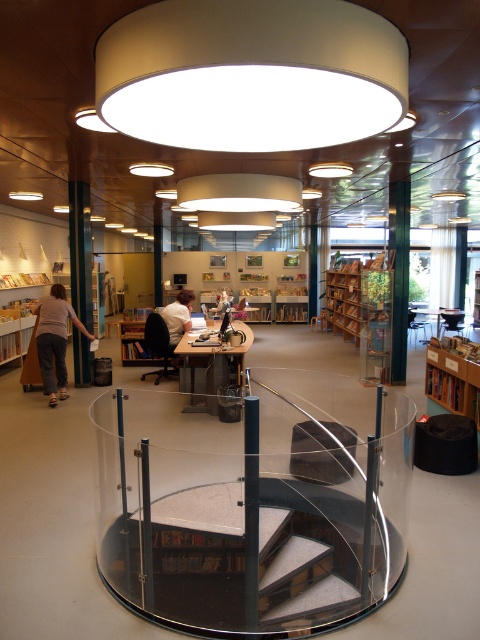
Question: Can you confirm if wooden bookshelf at center is positioned below white shirt at center?

Choices:
 (A) yes
 (B) no

Answer: (B)

Question: Can you confirm if matte gray pants at lower left is thinner than white shirt at center?

Choices:
 (A) yes
 (B) no

Answer: (B)

Question: Does transparent glass spiral staircase at center have a greater width compared to wooden bookshelf at lower right?

Choices:
 (A) yes
 (B) no

Answer: (A)

Question: Which point is closer to the camera?

Choices:
 (A) wooden bookshelf at lower right
 (B) matte black table at center

Answer: (A)

Question: Which point is closer to the camera taking this photo?

Choices:
 (A) (346, 321)
 (B) (44, 384)
 (C) (339, 429)

Answer: (C)

Question: Considering the real-world distances, which object is closest to the wooden bookshelf at center?

Choices:
 (A) white shirt at center
 (B) matte black table at center

Answer: (B)